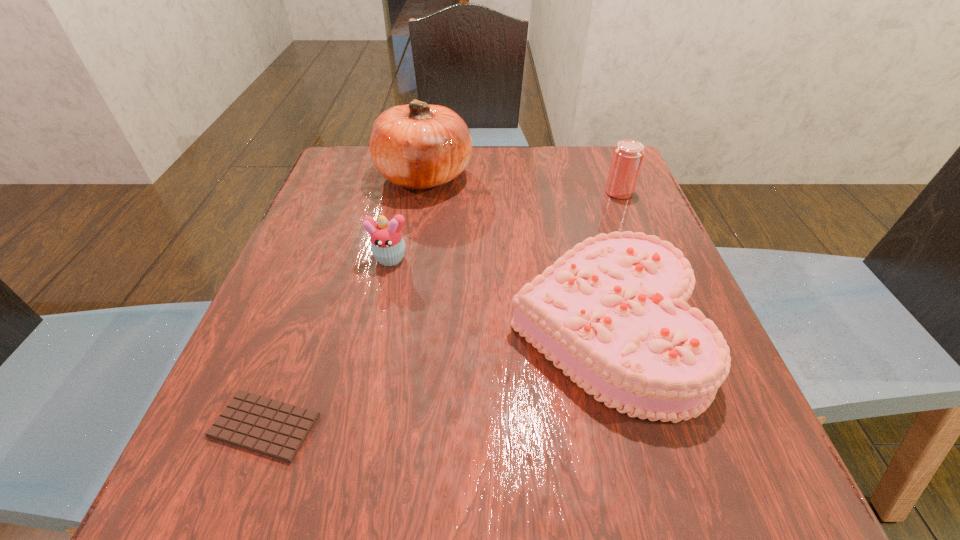
I want to click on vacant point located between the pumpkin and the cake, so click(514, 252).

Where is `free spot between the beer can and the pumpkin`? free spot between the beer can and the pumpkin is located at coordinates (522, 184).

Where is `free space between the cupcake and the chocolate bar`? The width and height of the screenshot is (960, 540). free space between the cupcake and the chocolate bar is located at coordinates (327, 342).

The height and width of the screenshot is (540, 960). What are the coordinates of `free area in between the cake and the chocolate bar` in the screenshot? It's located at (434, 377).

The image size is (960, 540). I want to click on free area in between the beer can and the shortest object, so click(x=442, y=309).

Find the location of `unoccupied area between the shortest object and the cake`. unoccupied area between the shortest object and the cake is located at coordinates (434, 377).

Where is `unoccupied position between the cake and the shortest object`? The image size is (960, 540). unoccupied position between the cake and the shortest object is located at coordinates (434, 377).

Locate which object is the closest to the beer can. Please provide its 2D coordinates. Your answer should be formatted as a tuple, i.e. [(x, y)], where the tuple contains the x and y coordinates of a point satisfying the conditions above.

[(611, 313)]

Identify which object is the closest to the shortest object. Please provide its 2D coordinates. Your answer should be formatted as a tuple, i.e. [(x, y)], where the tuple contains the x and y coordinates of a point satisfying the conditions above.

[(387, 243)]

The height and width of the screenshot is (540, 960). I want to click on vacant region that satisfies the following two spatial constraints: 1. on the face of the cake; 2. on the right side of the cupcake, so click(x=374, y=329).